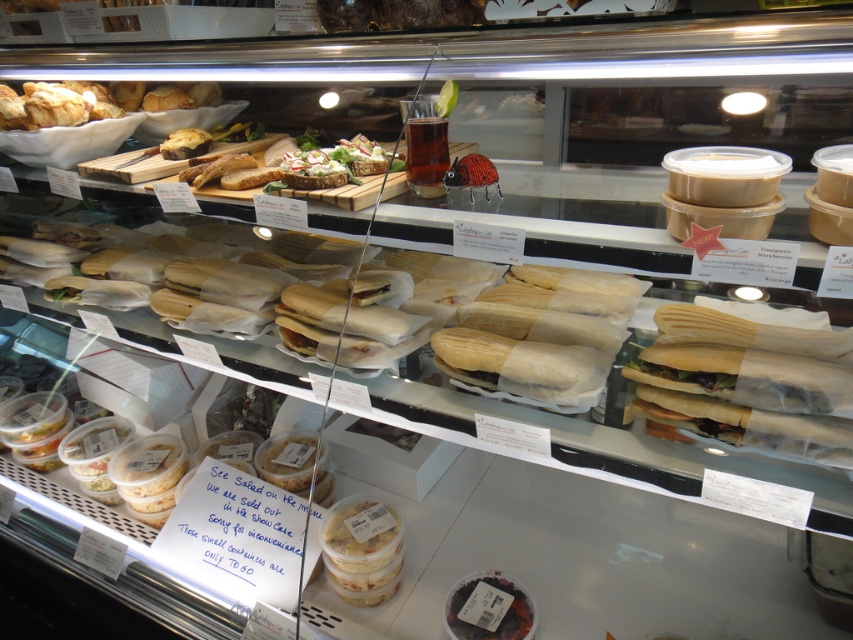
Consider the image. What is located at the point with coordinates (363, 548) in the bakery display case?

A translucent plastic salad container at center is located at point (363, 548) in the bakery display case.

You are a customer looking at the bakery display case. You want to find the translucent plastic salad container at center. Where should you look in the display case?

The translucent plastic salad container at center is located at the point with coordinates 0.859 on the x axis and 0.426 on the y axis.